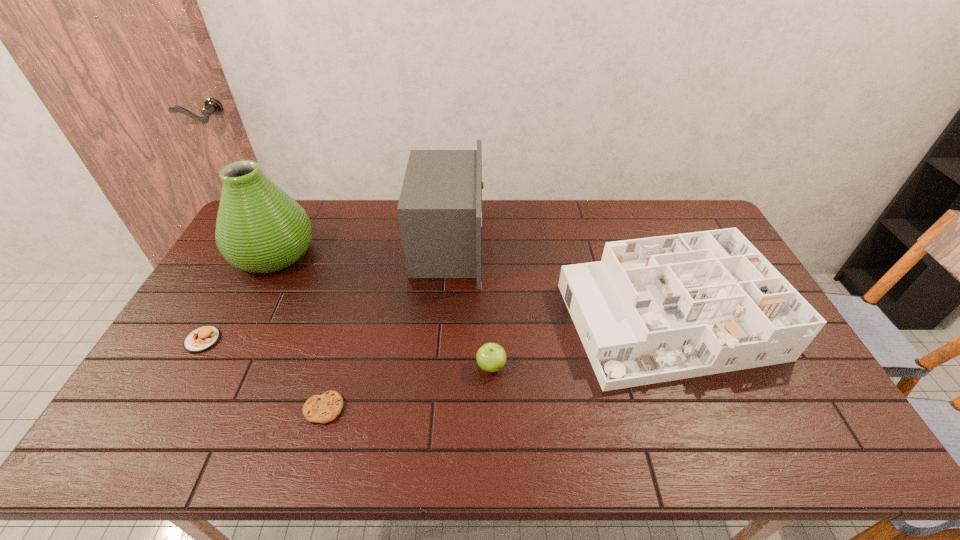
You are a GUI agent. You are given a task and a screenshot of the screen. Output one action in this format:
    pyautogui.click(x=<x>, y=<y>)
    Task: Click on the free spot between the vase and the shortest object
    The image size is (960, 540).
    Given the screenshot: What is the action you would take?
    pyautogui.click(x=299, y=331)

The image size is (960, 540). I want to click on unoccupied area between the vase and the patty, so click(238, 296).

This screenshot has width=960, height=540. Identify the location of vacant area between the fourth shortest object and the fourth tallest object. (579, 343).

Locate an element on the screen. Image resolution: width=960 pixels, height=540 pixels. free spot between the microwave oven and the shortest object is located at coordinates (386, 326).

Where is `object that is the second closest to the apple`? object that is the second closest to the apple is located at coordinates (440, 207).

In order to click on the closest object to the fifth tallest object in this screenshot , I will do `click(260, 229)`.

The height and width of the screenshot is (540, 960). I want to click on free space in the image that satisfies the following two spatial constraints: 1. on the front-facing side of the fifth shortest object; 2. on the front side of the fifth tallest object, so click(441, 340).

Where is `vacant space that satisfies the following two spatial constraints: 1. on the back side of the third tallest object; 2. on the right side of the third shortest object`? Image resolution: width=960 pixels, height=540 pixels. vacant space that satisfies the following two spatial constraints: 1. on the back side of the third tallest object; 2. on the right side of the third shortest object is located at coordinates (491, 321).

The height and width of the screenshot is (540, 960). What are the coordinates of `free point that satisfies the following two spatial constraints: 1. on the front-facing side of the second tallest object; 2. on the right side of the apple` in the screenshot? It's located at point(439,366).

Where is `free space that satisfies the following two spatial constraints: 1. on the back side of the third tallest object; 2. on the left side of the patty`? free space that satisfies the following two spatial constraints: 1. on the back side of the third tallest object; 2. on the left side of the patty is located at coordinates (213, 321).